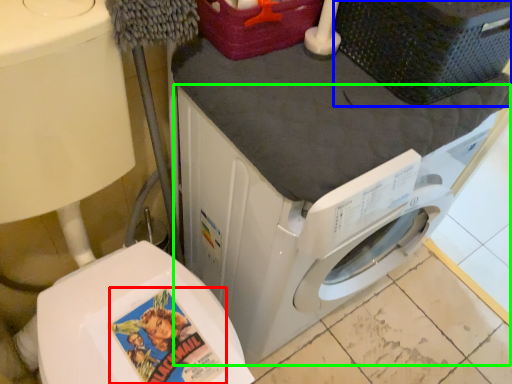
Question: Estimate the real-world distances between objects in this image. Which object is farther from comic book character (highlighted by a red box), basket (highlighted by a blue box) or washing machine (highlighted by a green box)?

Choices:
 (A) basket
 (B) washing machine

Answer: (A)